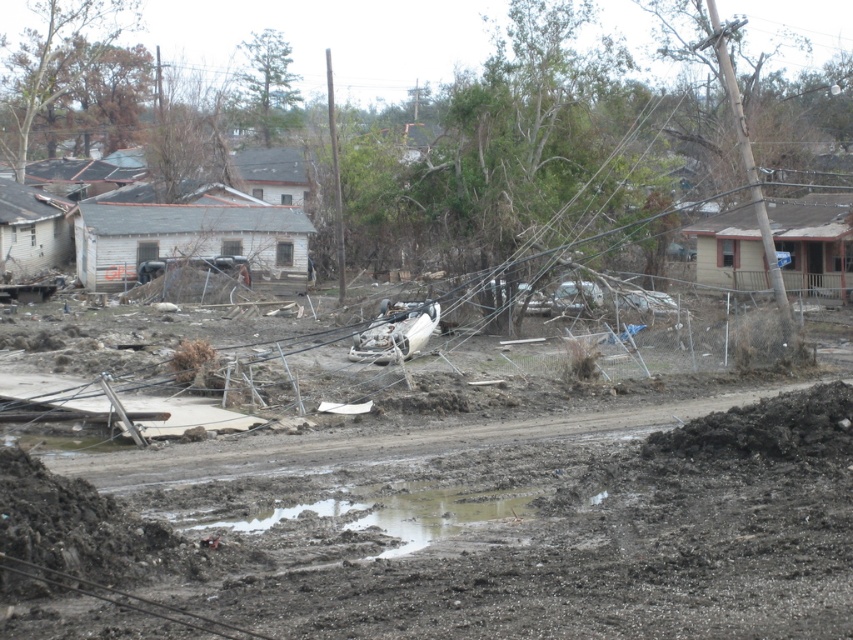
Based on the photo, does muddy soil at center appear under muddy water at center?

No, muddy soil at center is not below muddy water at center.

Can you confirm if muddy soil at center is taller than muddy water at center?

Indeed, muddy soil at center has a greater height compared to muddy water at center.

What do you see at coordinates (457, 529) in the screenshot? Image resolution: width=853 pixels, height=640 pixels. I see `muddy soil at center` at bounding box center [457, 529].

This screenshot has width=853, height=640. What are the coordinates of `muddy soil at center` in the screenshot? It's located at click(x=457, y=529).